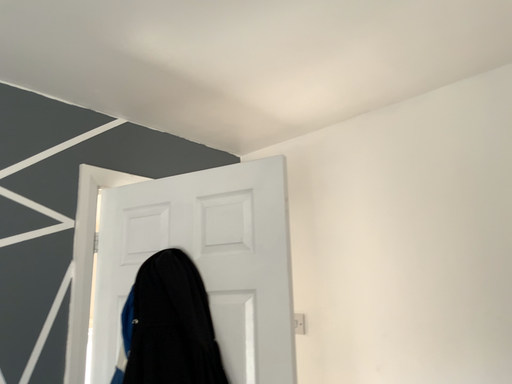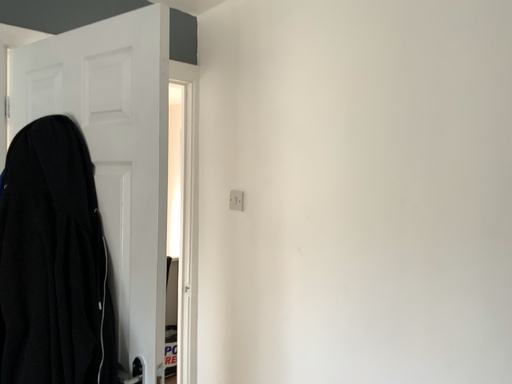
Question: Which way did the camera rotate in the video?

Choices:
 (A) rotated left
 (B) rotated right

Answer: (A)